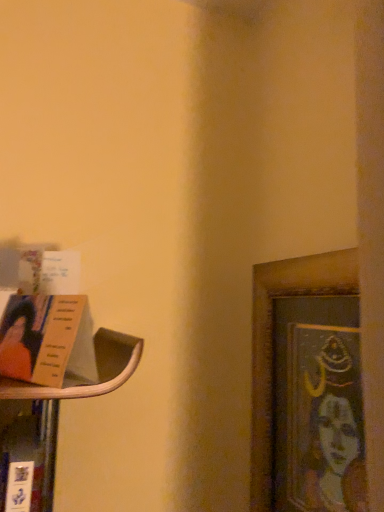
Question: Is wooden framed portrait at right situated inside matte paper book at left or outside?

Choices:
 (A) outside
 (B) inside

Answer: (A)

Question: From a real-world perspective, relative to matte paper book at left, is wooden framed portrait at right vertically above or below?

Choices:
 (A) above
 (B) below

Answer: (B)

Question: From the image's perspective, is wooden framed portrait at right above or below matte paper book at left?

Choices:
 (A) below
 (B) above

Answer: (A)

Question: From the image's perspective, relative to wooden framed portrait at right, is matte paper book at left above or below?

Choices:
 (A) below
 (B) above

Answer: (B)

Question: Is point (11, 331) positioned closer to the camera than point (253, 327)?

Choices:
 (A) farther
 (B) closer

Answer: (B)

Question: Relative to wooden framed portrait at right, is matte paper book at left in front or behind?

Choices:
 (A) front
 (B) behind

Answer: (A)

Question: From their relative heights in the image, would you say matte paper book at left is taller or shorter than wooden framed portrait at right?

Choices:
 (A) tall
 (B) short

Answer: (B)